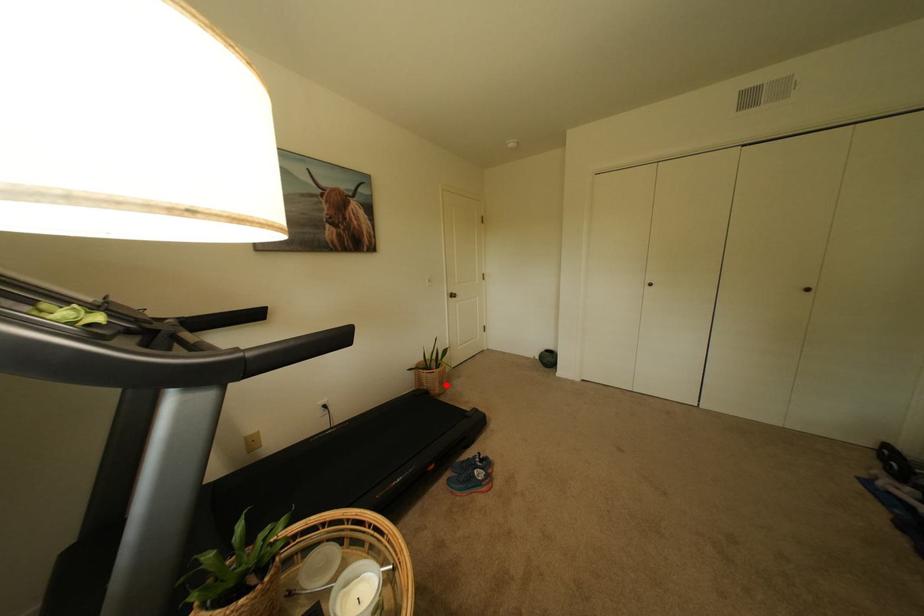
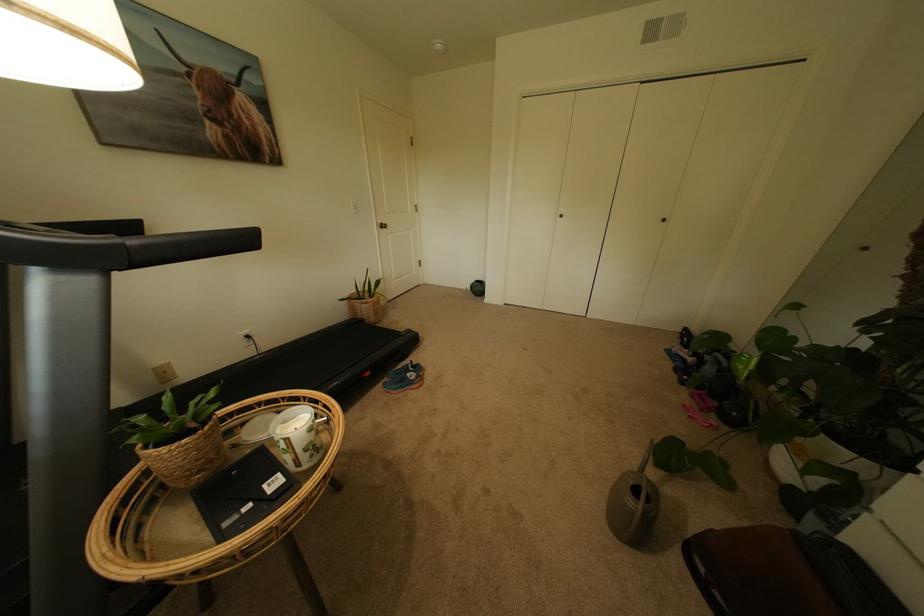
The point at the highlighted location is marked in the first image. Where is the corresponding point in the second image?

(382, 314)